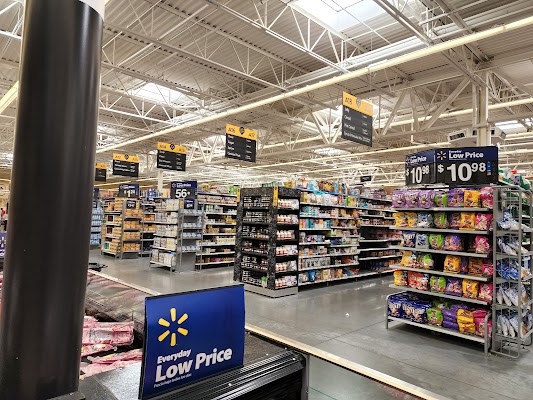
The width and height of the screenshot is (533, 400). I want to click on freezer case, so click(x=127, y=375).